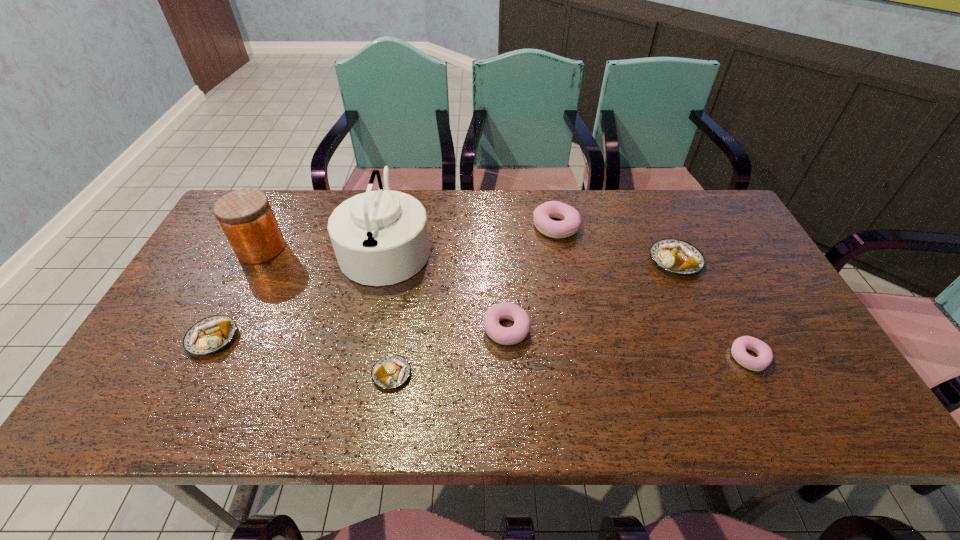
The image size is (960, 540). Identify the location of pink pastry object that ranks as the second closest to the fifth pastry from right to left. (571, 220).

You are a GUI agent. You are given a task and a screenshot of the screen. Output one action in this format:
    pyautogui.click(x=<x>, y=<y>)
    Task: Click on the brown pastry that stands as the closest to the smallest pink pastry
    
    Given the screenshot: What is the action you would take?
    pyautogui.click(x=675, y=256)

Identify which brown pastry is the second nearest to the farthest pastry. Please provide its 2D coordinates. Your answer should be formatted as a tuple, i.e. [(x, y)], where the tuple contains the x and y coordinates of a point satisfying the conditions above.

[(392, 371)]

I want to click on vacant area in the image that satisfies the following two spatial constraints: 1. on the spout of the tallest object; 2. on the left side of the farthest brown pastry, so click(383, 261).

Where is `free space that satisfies the following two spatial constraints: 1. on the spout of the biggest brown pastry; 2. on the left side of the tallest object`? Image resolution: width=960 pixels, height=540 pixels. free space that satisfies the following two spatial constraints: 1. on the spout of the biggest brown pastry; 2. on the left side of the tallest object is located at coordinates (383, 261).

Locate an element on the screen. The height and width of the screenshot is (540, 960). vacant point that satisfies the following two spatial constraints: 1. on the spout of the smallest pink pastry; 2. on the left side of the tallest object is located at coordinates (362, 357).

The image size is (960, 540). I want to click on free spot that satisfies the following two spatial constraints: 1. on the back side of the fourth pastry from right to left; 2. on the spout of the tallest object, so click(502, 246).

Where is `free region that satisfies the following two spatial constraints: 1. on the back side of the biggest brown pastry; 2. on the left side of the fourth pastry from right to left`? The height and width of the screenshot is (540, 960). free region that satisfies the following two spatial constraints: 1. on the back side of the biggest brown pastry; 2. on the left side of the fourth pastry from right to left is located at coordinates (503, 261).

Where is `free space that satisfies the following two spatial constraints: 1. on the back side of the leftmost pastry; 2. on the right side of the fifth nearest pastry`? This screenshot has height=540, width=960. free space that satisfies the following two spatial constraints: 1. on the back side of the leftmost pastry; 2. on the right side of the fifth nearest pastry is located at coordinates (252, 261).